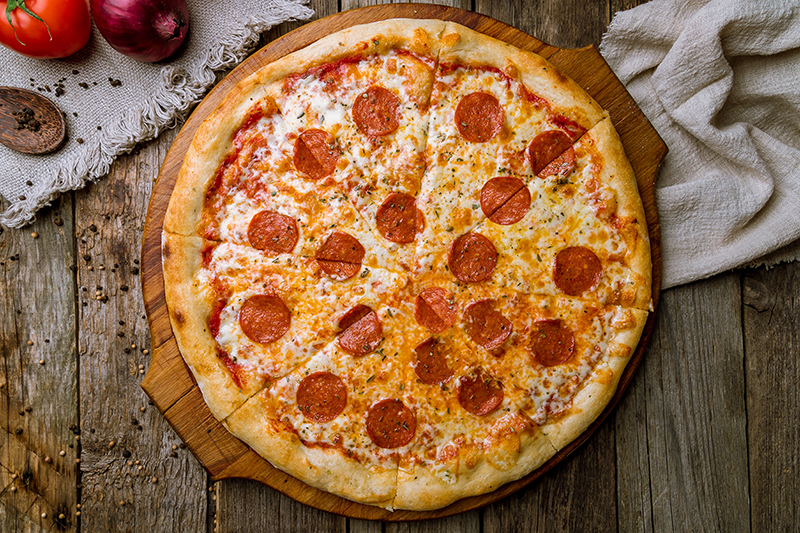
What are the coordinates of `planks on table` in the screenshot? It's located at (36, 357), (105, 341), (261, 506), (446, 524), (557, 518), (658, 503).